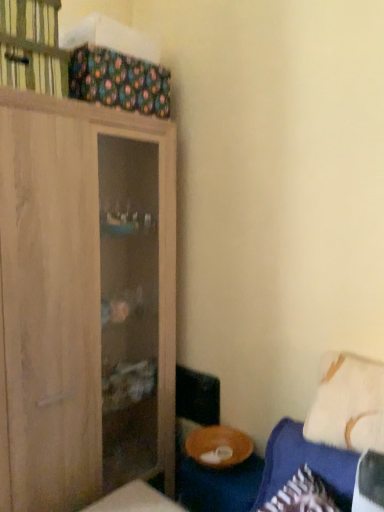
From the picture: In order to face blue fabric couch at lower right, should I rotate leftwards or rightwards?

To face it directly, rotate right by 11.609 degrees.

What is the approximate height of blue fabric couch at lower right?

The height of blue fabric couch at lower right is 17.66 inches.

Identify the location of white soft pillow at lower right. The height and width of the screenshot is (512, 384). (348, 404).

Describe the element at coordinates (348, 404) in the screenshot. I see `white soft pillow at lower right` at that location.

Find the location of a particular element. wooden cabinet at upper left is located at coordinates (32, 47).

Which object is more forward, blue fabric couch at lower right or wooden cabinet at upper left?

Positioned in front is blue fabric couch at lower right.

Looking at their sizes, would you say blue fabric couch at lower right is wider or thinner than wooden cabinet at upper left?

In the image, blue fabric couch at lower right appears to be more narrow than wooden cabinet at upper left.

From a real-world perspective, between blue fabric couch at lower right and wooden cabinet at upper left, who is vertically lower?

From a 3D spatial view, blue fabric couch at lower right is below.

What's the angular difference between white soft pillow at lower right and wooden cabinet at upper left's facing directions?

81.6 degrees separate the facing orientations of white soft pillow at lower right and wooden cabinet at upper left.

From the image's perspective, which one is positioned higher, white soft pillow at lower right or wooden cabinet at upper left?

From the image's view, wooden cabinet at upper left is above.

Which point is more distant from viewer, (339,437) or (5,33)?

The point (339,437) is more distant.

Is wooden bowl at lower right touching white soft pillow at lower right?

No, wooden bowl at lower right is not next to white soft pillow at lower right.

Is wooden bowl at lower right facing away from white soft pillow at lower right?

No, wooden bowl at lower right's orientation is not away from white soft pillow at lower right.

The image size is (384, 512). I want to click on pillow that is above the wooden bowl at lower right (from a real-world perspective), so click(348, 404).

Is point (307, 444) positioned behind point (244, 493)?

No, it is in front of (244, 493).

Is blue fabric couch at lower right far away from wooden bowl at lower right?

They are positioned close to each other.

Who is more distant, blue fabric couch at lower right or wooden bowl at lower right?

wooden bowl at lower right is further from the camera.

Considering the relative sizes of blue fabric couch at lower right and wooden bowl at lower right in the image provided, is blue fabric couch at lower right taller than wooden bowl at lower right?

Correct, blue fabric couch at lower right is much taller as wooden bowl at lower right.

Is blue fabric couch at lower right taller or shorter than light wood cabinet at left?

Clearly, blue fabric couch at lower right is shorter compared to light wood cabinet at left.

Considering the sizes of blue fabric couch at lower right and light wood cabinet at left in the image, is blue fabric couch at lower right bigger or smaller than light wood cabinet at left?

Considering their sizes, blue fabric couch at lower right takes up less space than light wood cabinet at left.

In the scene shown: Would you say blue fabric couch at lower right is to the left or to the right of light wood cabinet at left in the picture?

In the image, blue fabric couch at lower right appears on the right side of light wood cabinet at left.

From a real-world perspective, is blue fabric couch at lower right beneath light wood cabinet at left?

Yes, from a real-world perspective, blue fabric couch at lower right is below light wood cabinet at left.

Locate an element on the screen. This screenshot has height=512, width=384. pillow above the blue fabric couch at lower right (from the image's perspective) is located at coordinates coord(348,404).

Considering the sizes of objects blue fabric couch at lower right and white soft pillow at lower right in the image provided, who is bigger, blue fabric couch at lower right or white soft pillow at lower right?

Result: blue fabric couch at lower right is bigger.

Is blue fabric couch at lower right shorter than white soft pillow at lower right?

Incorrect, the height of blue fabric couch at lower right does not fall short of that of white soft pillow at lower right.

Considering the points (23, 48) and (313, 500), which point is behind, point (23, 48) or point (313, 500)?

The point (23, 48) is farther.

Is wooden cabinet at upper left shorter than blue fabric couch at lower right?

Yes, wooden cabinet at upper left is shorter than blue fabric couch at lower right.

From a real-world perspective, does wooden cabinet at upper left sit lower than blue fabric couch at lower right?

No, from a real-world perspective, wooden cabinet at upper left is not under blue fabric couch at lower right.

Would you say wooden cabinet at upper left is a long distance from blue fabric couch at lower right?

Yes, wooden cabinet at upper left and blue fabric couch at lower right are located far from each other.

Where is `couch below the wooden cabinet at upper left (from the image's perspective)`? This screenshot has width=384, height=512. couch below the wooden cabinet at upper left (from the image's perspective) is located at coordinates (317, 475).

I want to click on cabinet that is above the white soft pillow at lower right (from a real-world perspective), so click(32, 47).

Estimate the real-world distances between objects in this image. Which object is further from wooden bowl at lower right, white soft pillow at lower right or light wood cabinet at left?

Based on the image, light wood cabinet at left appears to be further to wooden bowl at lower right.

Considering their positions, is wooden bowl at lower right positioned further to wooden cabinet at upper left than white soft pillow at lower right?

wooden bowl at lower right lies further to wooden cabinet at upper left than the other object.

From the image, which object appears to be farther from white soft pillow at lower right, wooden cabinet at upper left or blue fabric couch at lower right?

Based on the image, wooden cabinet at upper left appears to be further to white soft pillow at lower right.

From the image, which object appears to be nearer to blue fabric couch at lower right, wooden cabinet at upper left or light wood cabinet at left?

light wood cabinet at left.

Estimate the real-world distances between objects in this image. Which object is further from wooden cabinet at upper left, blue fabric couch at lower right or wooden bowl at lower right?

wooden bowl at lower right lies further to wooden cabinet at upper left than the other object.

Looking at the image, which one is located closer to light wood cabinet at left, white soft pillow at lower right or blue fabric couch at lower right?

blue fabric couch at lower right is closer to light wood cabinet at left.

When comparing their distances from wooden bowl at lower right, does blue fabric couch at lower right or light wood cabinet at left seem closer?

blue fabric couch at lower right lies closer to wooden bowl at lower right than the other object.

Consider the image. When comparing their distances from blue fabric couch at lower right, does wooden bowl at lower right or white soft pillow at lower right seem closer?

Based on the image, white soft pillow at lower right appears to be nearer to blue fabric couch at lower right.

I want to click on table between light wood cabinet at left and blue fabric couch at lower right, so click(219, 485).

At what (x,y) coordinates should I click in order to perform the action: click on cabinetry between wooden cabinet at upper left and wooden bowl at lower right vertically. Please return your answer as a coordinate pair (x, y). Looking at the image, I should click on (85, 300).

Identify the location of pillow between wooden cabinet at upper left and blue fabric couch at lower right vertically. [348, 404].

I want to click on couch that lies between wooden cabinet at upper left and wooden bowl at lower right from top to bottom, so click(317, 475).